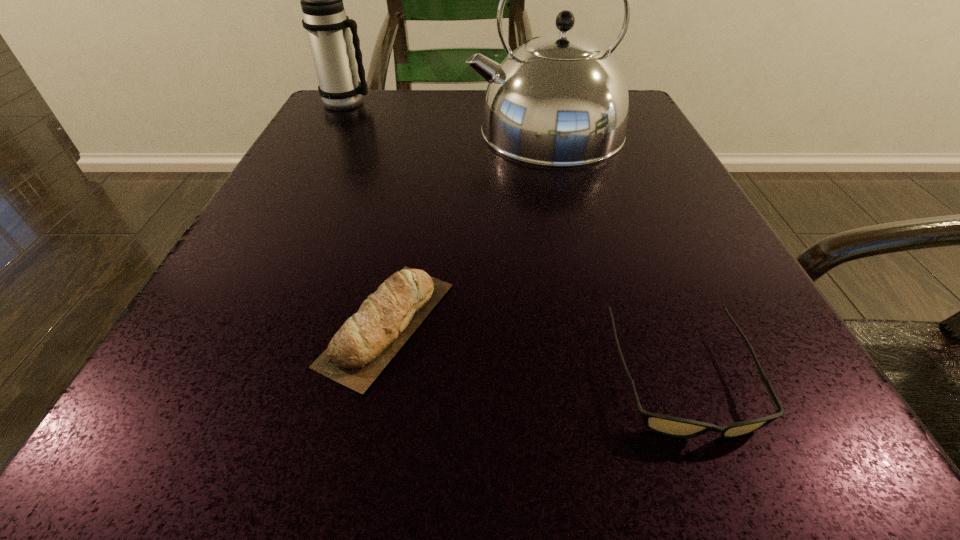
Where is `vacant space in between the thermos bottle and the pita bread`? This screenshot has width=960, height=540. vacant space in between the thermos bottle and the pita bread is located at coordinates (367, 213).

Find the location of a particular element. The height and width of the screenshot is (540, 960). free point between the third shortest object and the sunglasses is located at coordinates (514, 240).

Locate an element on the screen. The image size is (960, 540). vacant area between the second object from left to right and the leftmost object is located at coordinates (367, 213).

The width and height of the screenshot is (960, 540). I want to click on vacant area between the third object from right to left and the second tallest object, so click(x=367, y=213).

At what (x,y) coordinates should I click in order to perform the action: click on vacant area that lies between the sunglasses and the third object from right to left. Please return your answer as a coordinate pair (x, y). Looking at the image, I should click on (535, 350).

Identify which object is the second nearest to the second tallest object. Please provide its 2D coordinates. Your answer should be formatted as a tuple, i.e. [(x, y)], where the tuple contains the x and y coordinates of a point satisfying the conditions above.

[(365, 344)]

Locate which object ranks third in proximity to the sunglasses. Please provide its 2D coordinates. Your answer should be formatted as a tuple, i.e. [(x, y)], where the tuple contains the x and y coordinates of a point satisfying the conditions above.

[(324, 18)]

Where is `vacant area that satisfies the following two spatial constraints: 1. on the side with the handle of the leftmost object; 2. on the left side of the third object from right to left`? The height and width of the screenshot is (540, 960). vacant area that satisfies the following two spatial constraints: 1. on the side with the handle of the leftmost object; 2. on the left side of the third object from right to left is located at coordinates (229, 323).

I want to click on blank area in the image that satisfies the following two spatial constraints: 1. on the side with the handle of the pita bread; 2. on the right side of the second tallest object, so click(229, 323).

Identify the location of vacant area that satisfies the following two spatial constraints: 1. on the side with the handle of the pita bread; 2. on the left side of the third shortest object. The height and width of the screenshot is (540, 960). (229, 323).